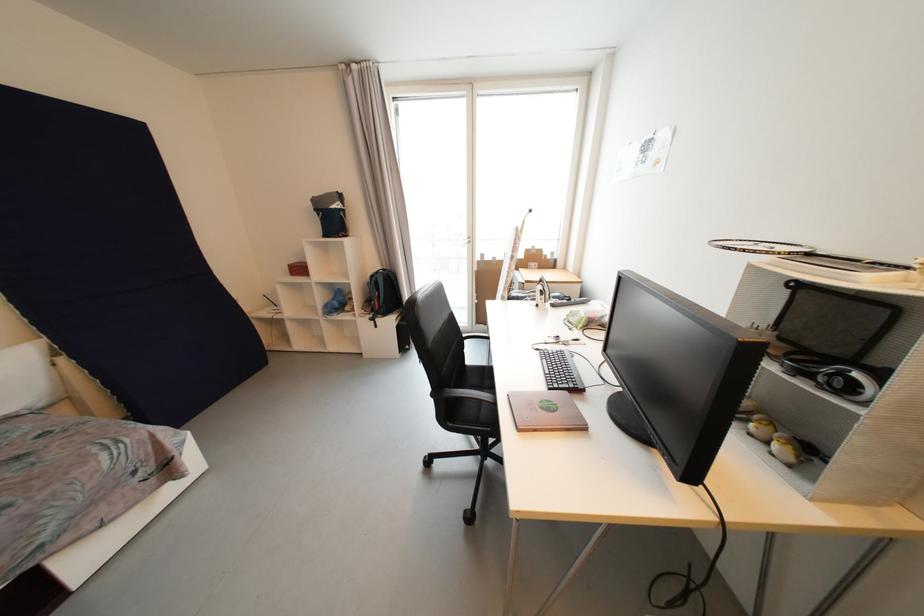
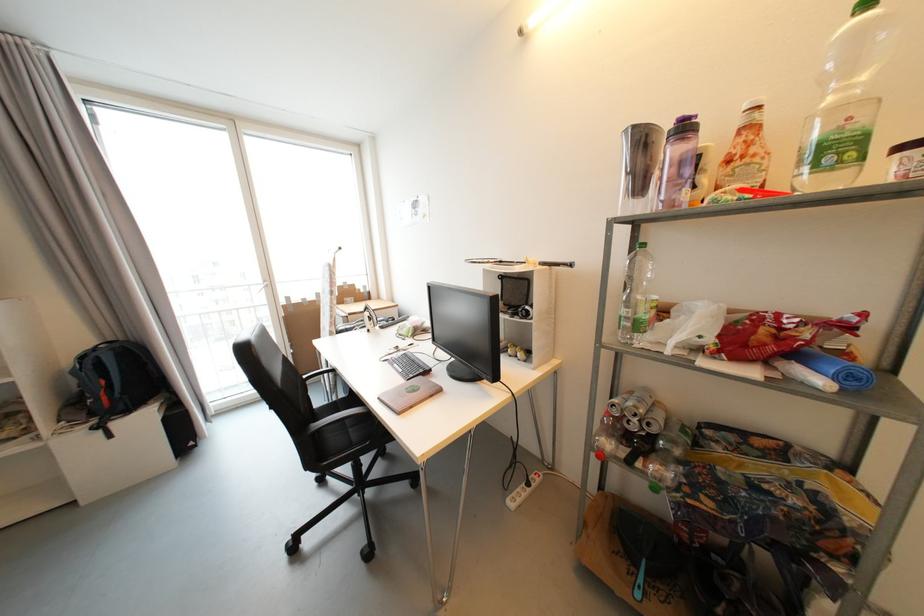
Find the pixel in the second image that matches point (561, 387) in the first image.

(417, 378)